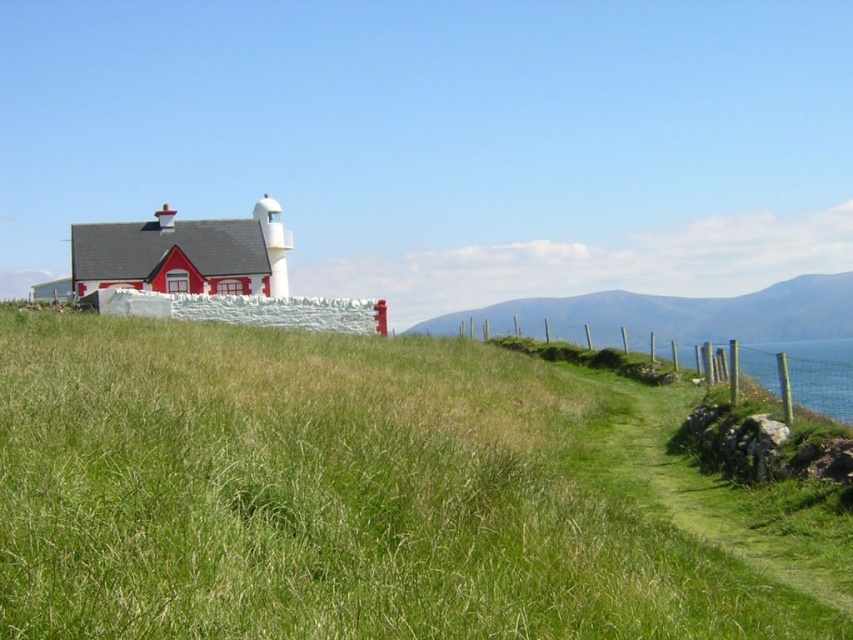
Is point (271, 534) farther from viewer compared to point (630, 324)?

No, it is not.

Does green grassy at center have a lesser height compared to green grassy hillside at center?

Yes, green grassy at center is shorter than green grassy hillside at center.

What do you see at coordinates (331, 497) in the screenshot? I see `green grassy at center` at bounding box center [331, 497].

This screenshot has height=640, width=853. I want to click on green grassy at center, so click(331, 497).

Is point (728, 500) positioned after point (840, 307)?

No, (728, 500) is in front of (840, 307).

Consider the image. Can you confirm if green grassy path at center-right is wider than green grassy hillside at center?

No.

Does point (590, 353) lie in front of point (822, 276)?

Yes, point (590, 353) is in front of point (822, 276).

Identify the location of green grassy path at center-right. (712, 483).

Does point (90, 627) lie in front of point (822, 564)?

Yes, it is.

In the scene shown: Is green grassy at center taller than green grassy path at center-right?

Yes.

Which is in front, point (257, 444) or point (764, 490)?

Point (257, 444) is more forward.

I want to click on green grassy at center, so click(x=331, y=497).